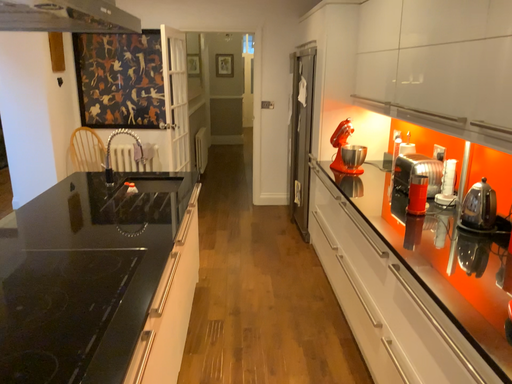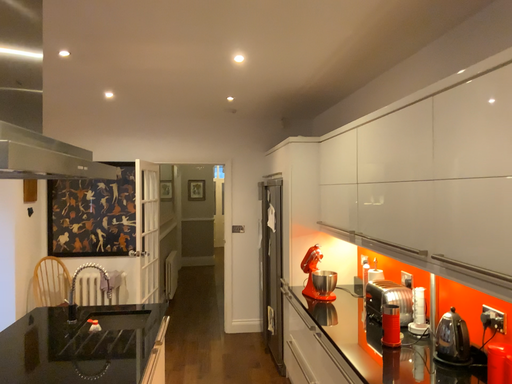
Question: How did the camera likely rotate when shooting the video?

Choices:
 (A) rotated downward
 (B) rotated upward

Answer: (B)